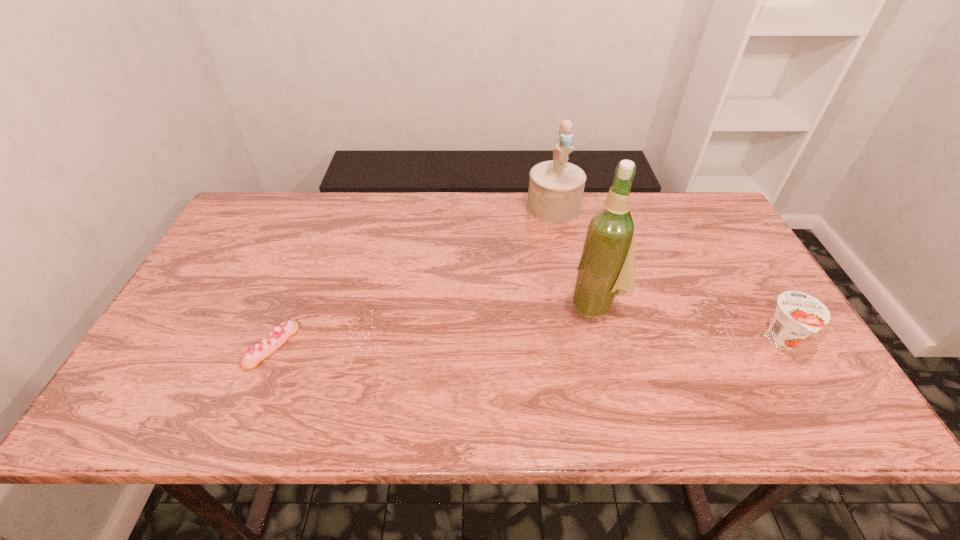
Locate an element on the screen. This screenshot has width=960, height=540. vacant region between the figurine and the yogurt is located at coordinates (667, 274).

Find the location of a particular element. Image resolution: width=960 pixels, height=540 pixels. empty space between the tallest object and the third shortest object is located at coordinates (574, 256).

I want to click on free space between the tallest object and the third shortest object, so click(x=574, y=256).

Image resolution: width=960 pixels, height=540 pixels. I want to click on free space between the third tallest object and the second tallest object, so click(667, 274).

Find the location of a particular element. This screenshot has height=540, width=960. empty location between the rightmost object and the third shortest object is located at coordinates (667, 274).

Identify the location of empty space that is in between the tallest object and the shortest object. This screenshot has width=960, height=540. (434, 325).

Identify which object is the third closest to the rightmost object. Please provide its 2D coordinates. Your answer should be formatted as a tuple, i.e. [(x, y)], where the tuple contains the x and y coordinates of a point satisfying the conditions above.

[(271, 343)]

The image size is (960, 540). Identify the location of object that stands as the second closest to the yogurt. (556, 187).

Image resolution: width=960 pixels, height=540 pixels. What are the coordinates of `vacant space that satisfies the following two spatial constraints: 1. on the back side of the tallest object; 2. on the right side of the shortest object` in the screenshot? It's located at (289, 304).